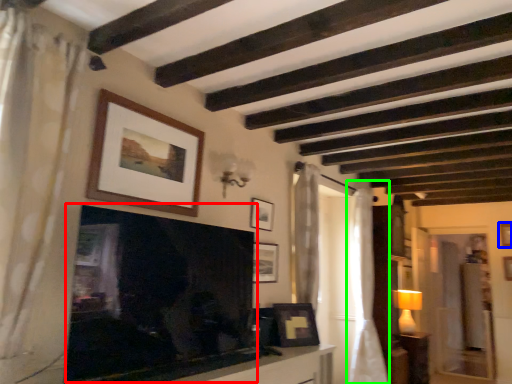
Question: Which object is the closest to the fireplace (highlighted by a red box)? Choose among these: picture frame (highlighted by a blue box) or curtain (highlighted by a green box).

Choices:
 (A) picture frame
 (B) curtain

Answer: (B)